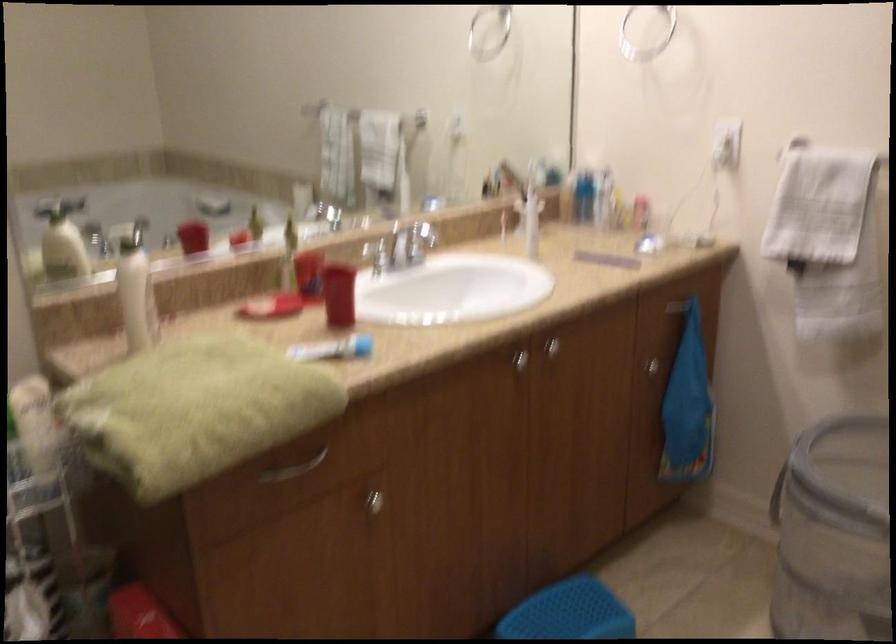
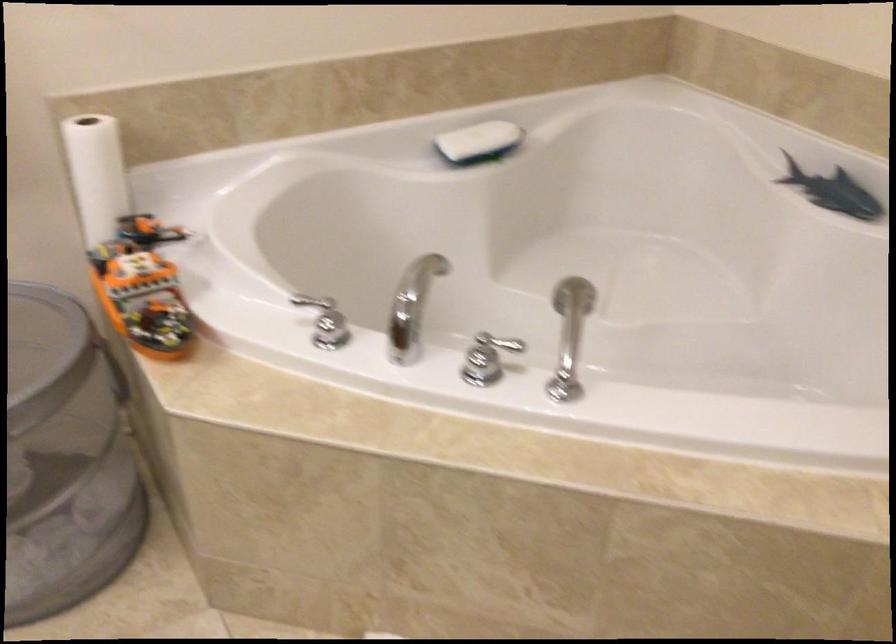
Based on the continuous images, in which direction is the camera rotating?

The rotation direction of the camera is right-down.